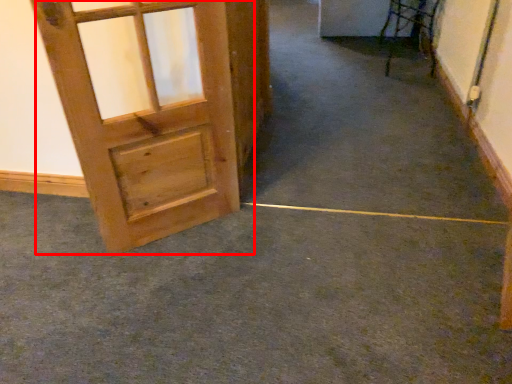
Question: From the image's perspective, considering the relative positions of door (annotated by the red box) and concrete in the image provided, where is door (annotated by the red box) located with respect to the staircase?

Choices:
 (A) below
 (B) above

Answer: (B)